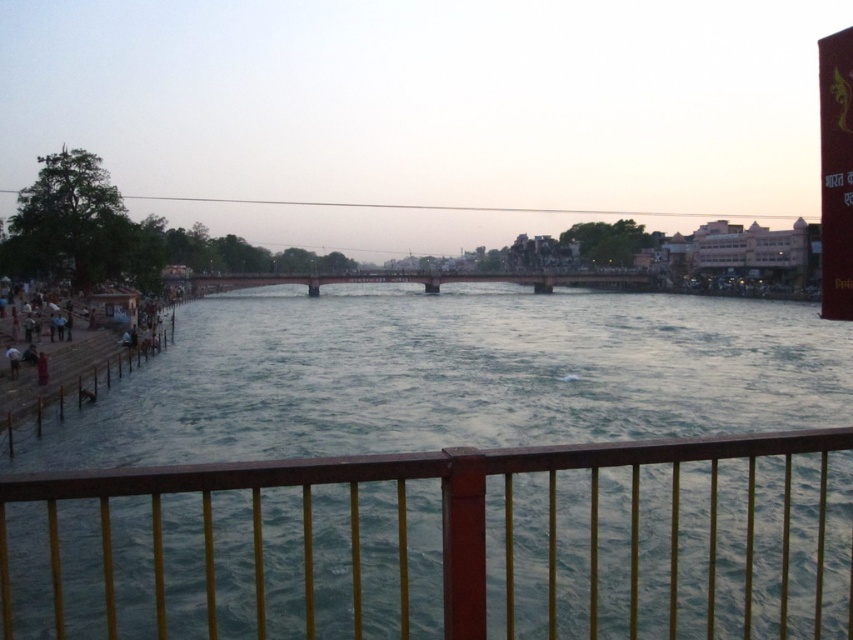
You are standing on the riverside and want to take a photo of both the brown wooden fence at lower center and the metallic bridge at center. Since you have a limited field of view, will you be able to capture both in a single frame without moving your camera?

The brown wooden fence at lower center is in front of the metallic bridge at center, so if you position yourself so that both are within your camera frame, you can capture both objects as the fence is closer to you and the bridge is behind it in the same line of sight.

You are a delivery drone that needs to fly from the wooden dock at lower left to the metallic bridge at center. What is the minimum distance you must cover?

The wooden dock at lower left and metallic bridge at center are 234.88 feet apart from each other, so the minimum distance you must cover is 234.88 feet.

You are standing on the bridge and want to take a photo of the dark blue fabric person at lower left without the metallic bridge at center blocking the view. Is it possible?

The metallic bridge at center is larger than the dark blue fabric person at lower left, so it might block the view depending on their positions. However, since the person is at lower left and the bridge is at center, adjusting your angle slightly to the left could allow you to capture the person without the bridge obstructing the shot.